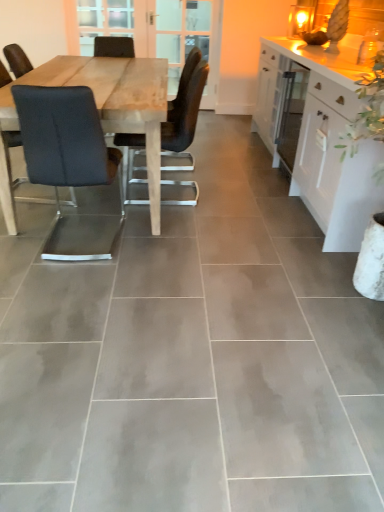
Question: Based on their positions, is black fabric chair at left, positioned as the second chair in right-to-left order, located to the left or right of wooden screen door at center, the first screen door when ordered from left to right?

Choices:
 (A) right
 (B) left

Answer: (B)

Question: Is black fabric chair at left, which is the first chair from left to right, bigger or smaller than wooden screen door at center, the first screen door when ordered from left to right?

Choices:
 (A) big
 (B) small

Answer: (B)

Question: Estimate the real-world distances between objects in this image. Which object is farther from the matte black chair at center, which is the first chair in right-to-left order?

Choices:
 (A) black fabric chair at left, which is the first chair from left to right
 (B) wooden screen door at center, which is counted as the 2th screen door, starting from the right
 (C) white glossy cabinet at right
 (D) clear glass screen door at upper center, which is counted as the first screen door, starting from the right

Answer: (D)

Question: Estimate the real-world distances between objects in this image. Which object is closer to the clear glass screen door at upper center, which is counted as the first screen door, starting from the right?

Choices:
 (A) matte black chair at center, which is the first chair in right-to-left order
 (B) white glossy cabinet at right
 (C) wooden screen door at center, the first screen door when ordered from left to right
 (D) black fabric chair at left, positioned as the second chair in right-to-left order

Answer: (C)